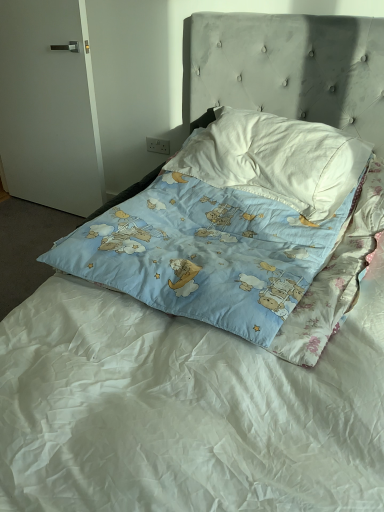
Question: Does white cotton pillow at upper center, positioned as the 2th pillow in bottom-to-top order, have a greater width compared to blue cotton pillow at center, the 2th pillow positioned from the top?

Choices:
 (A) yes
 (B) no

Answer: (B)

Question: Is white cotton pillow at upper center, the first pillow when ordered from top to bottom, taller than blue cotton pillow at center, which ranks as the first pillow in bottom-to-top order?

Choices:
 (A) no
 (B) yes

Answer: (A)

Question: Would you consider white cotton pillow at upper center, positioned as the 2th pillow in bottom-to-top order, to be distant from blue cotton pillow at center, which ranks as the first pillow in bottom-to-top order?

Choices:
 (A) no
 (B) yes

Answer: (A)

Question: From the image's perspective, is white cotton pillow at upper center, positioned as the 2th pillow in bottom-to-top order, located beneath blue cotton pillow at center, the 2th pillow positioned from the top?

Choices:
 (A) no
 (B) yes

Answer: (A)

Question: Is white cotton pillow at upper center, positioned as the 2th pillow in bottom-to-top order, smaller than blue cotton pillow at center, which ranks as the first pillow in bottom-to-top order?

Choices:
 (A) yes
 (B) no

Answer: (A)

Question: Is white cotton pillow at upper center, the first pillow when ordered from top to bottom, looking in the opposite direction of blue cotton pillow at center, the 2th pillow positioned from the top?

Choices:
 (A) no
 (B) yes

Answer: (B)

Question: From the image's perspective, is blue cotton pillow at center, which ranks as the first pillow in bottom-to-top order, beneath white matte door at left?

Choices:
 (A) yes
 (B) no

Answer: (A)

Question: From a real-world perspective, is blue cotton pillow at center, which ranks as the first pillow in bottom-to-top order, on top of white matte door at left?

Choices:
 (A) no
 (B) yes

Answer: (A)

Question: From a real-world perspective, does blue cotton pillow at center, which ranks as the first pillow in bottom-to-top order, sit lower than white matte door at left?

Choices:
 (A) yes
 (B) no

Answer: (A)

Question: Considering the relative sizes of blue cotton pillow at center, which ranks as the first pillow in bottom-to-top order, and white matte door at left in the image provided, is blue cotton pillow at center, which ranks as the first pillow in bottom-to-top order, shorter than white matte door at left?

Choices:
 (A) no
 (B) yes

Answer: (B)

Question: Does blue cotton pillow at center, the 2th pillow positioned from the top, appear on the right side of white matte door at left?

Choices:
 (A) yes
 (B) no

Answer: (A)

Question: Considering the relative positions of blue cotton pillow at center, which ranks as the first pillow in bottom-to-top order, and white matte door at left in the image provided, is blue cotton pillow at center, which ranks as the first pillow in bottom-to-top order, to the left of white matte door at left from the viewer's perspective?

Choices:
 (A) no
 (B) yes

Answer: (A)

Question: From a real-world perspective, is white matte door at left under white cotton pillow at upper center, the first pillow when ordered from top to bottom?

Choices:
 (A) no
 (B) yes

Answer: (B)